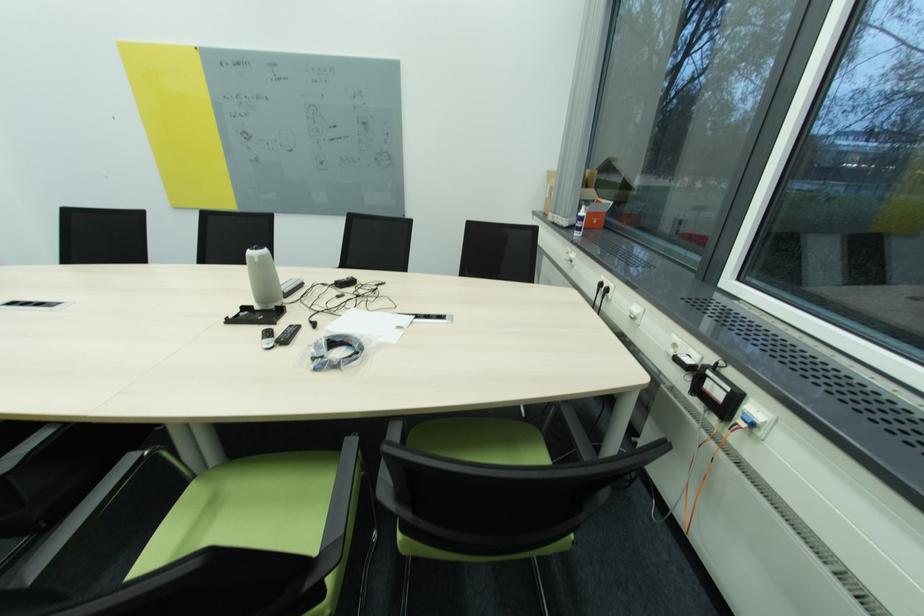
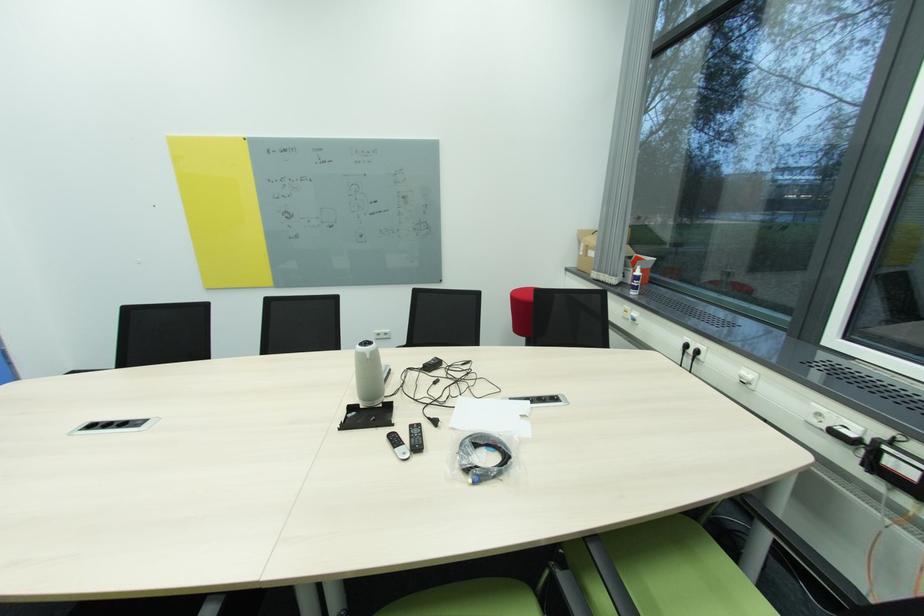
In the second image, find the point that corresponds to pixel 314 323 in the first image.

(433, 419)